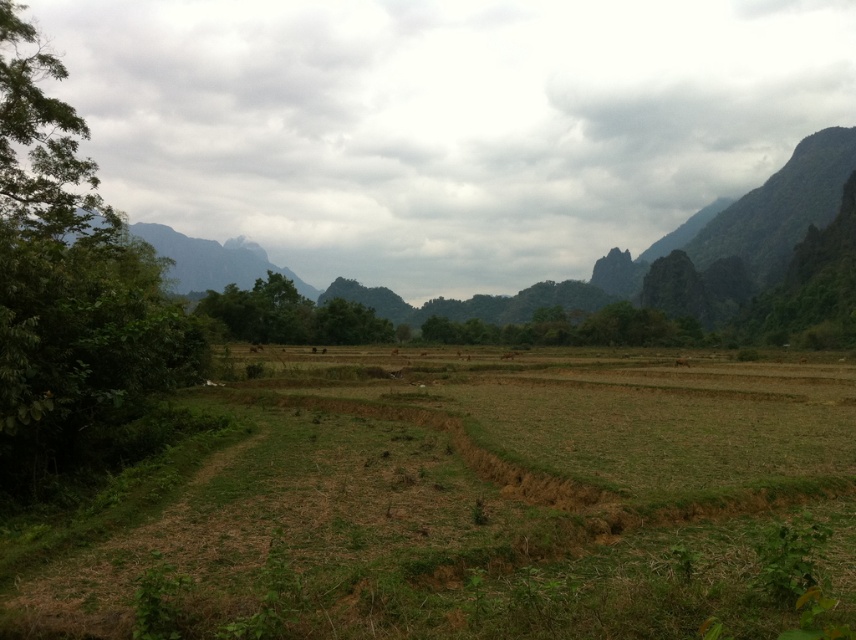
From the picture: Does green grassy field at center have a smaller size compared to green leafy tree at left?

Yes, green grassy field at center is smaller than green leafy tree at left.

Who is positioned more to the left, green grassy field at center or green leafy tree at left?

Positioned to the left is green leafy tree at left.

Is point (155, 508) farther from camera compared to point (1, 484)?

No.

Locate an element on the screen. green grassy field at center is located at coordinates (467, 502).

Which is above, green grassy field at center or rugged granite mountain at upper left?

rugged granite mountain at upper left is higher up.

Can you confirm if green grassy field at center is positioned below rugged granite mountain at upper left?

Correct, green grassy field at center is located below rugged granite mountain at upper left.

Find the location of a particular element. green grassy field at center is located at coordinates (467, 502).

Based on the photo, which of these two, green leafy tree at left or rugged granite mountain at upper left, stands taller?

rugged granite mountain at upper left is taller.

Which is below, green leafy tree at left or rugged granite mountain at upper left?

green leafy tree at left is below.

Describe the element at coordinates (72, 294) in the screenshot. I see `green leafy tree at left` at that location.

Where is `green leafy tree at left`? green leafy tree at left is located at coordinates (72, 294).